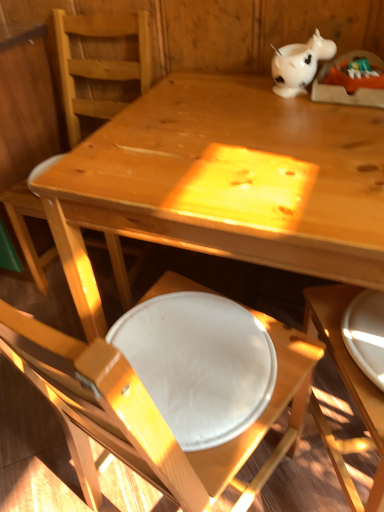
The height and width of the screenshot is (512, 384). Identify the location of free space in front of white glossy piggy bank at upper right. (303, 108).